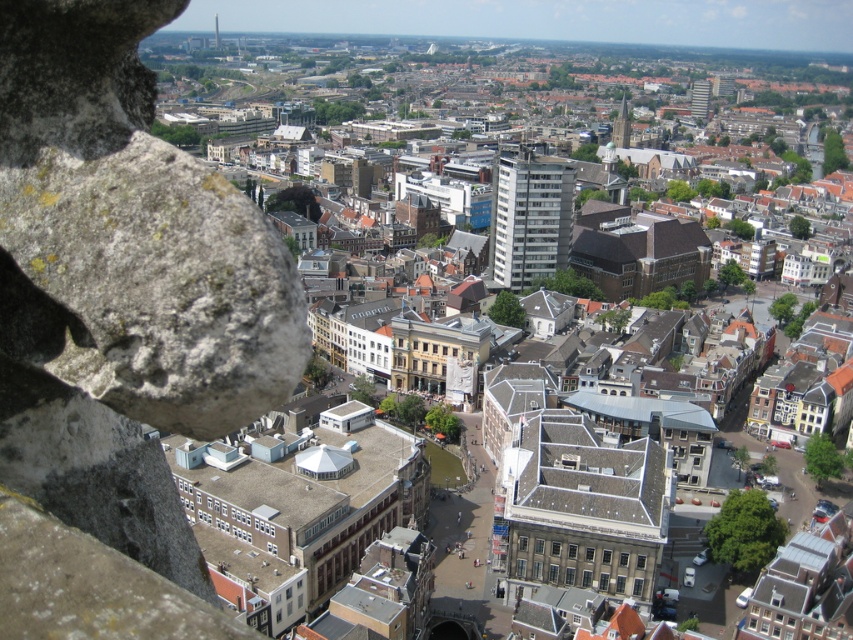
Consider the image. Between dark gray stone tower at center and smooth gray tower at upper center, which one is positioned higher?

smooth gray tower at upper center is above.

Can you confirm if dark gray stone tower at center is positioned below smooth gray tower at upper center?

Yes, dark gray stone tower at center is below smooth gray tower at upper center.

Is point (619, 145) positioned behind point (216, 17)?

No, it is not.

Find the location of `dark gray stone tower at center`. dark gray stone tower at center is located at coordinates (621, 125).

Is point (500, 234) farther from viewer compared to point (619, 147)?

That is False.

Who is lower down, white smooth building at center or dark gray stone tower at center?

white smooth building at center is lower down.

What do you see at coordinates (529, 220) in the screenshot? I see `white smooth building at center` at bounding box center [529, 220].

Where is `white smooth building at center`? The width and height of the screenshot is (853, 640). white smooth building at center is located at coordinates (529, 220).

Locate an element on the screen. light gray concrete building at upper center is located at coordinates (700, 99).

Is light gray concrete building at upper center smaller than smooth gray tower at upper center?

No, light gray concrete building at upper center is not smaller than smooth gray tower at upper center.

This screenshot has width=853, height=640. Find the location of `light gray concrete building at upper center`. light gray concrete building at upper center is located at coordinates tap(700, 99).